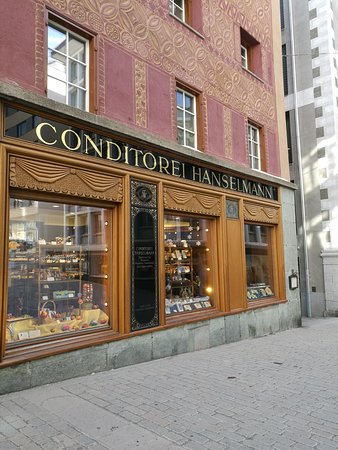
Where is `windows`? The width and height of the screenshot is (338, 450). windows is located at coordinates (180, 7), (256, 148), (246, 58), (197, 128), (69, 76), (62, 318), (185, 259), (258, 277).